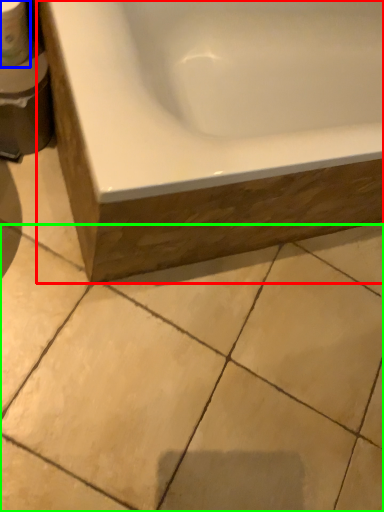
Question: Which object is positioned farthest from bathtub (highlighted by a red box)? Select from toilet paper (highlighted by a blue box) and ceramic tile (highlighted by a green box).

Choices:
 (A) toilet paper
 (B) ceramic tile

Answer: (A)